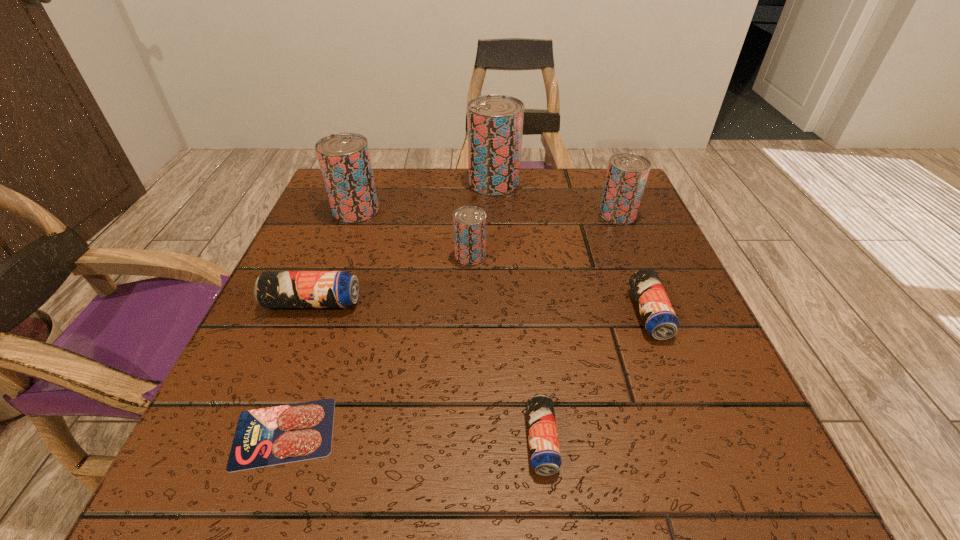
Find the location of a particular element. This screenshot has width=960, height=540. the farthest red beer can is located at coordinates (495, 122).

This screenshot has height=540, width=960. Find the location of `the tallest beer can`. the tallest beer can is located at coordinates (495, 122).

Where is `the second biggest red beer can`? the second biggest red beer can is located at coordinates (344, 158).

Identify the location of the seventh shortest object. Image resolution: width=960 pixels, height=540 pixels. (344, 158).

You are a GUI agent. You are given a task and a screenshot of the screen. Output one action in this format:
    pyautogui.click(x=<x>, y=<y>)
    Task: Click on the third biggest red beer can
    This screenshot has height=540, width=960.
    Given the screenshot: What is the action you would take?
    pyautogui.click(x=627, y=173)

You are a GUI agent. You are given a task and a screenshot of the screen. Output one action in this format:
    pyautogui.click(x=<x>, y=<y>)
    Task: Click on the third tallest object
    The height and width of the screenshot is (540, 960).
    Given the screenshot: What is the action you would take?
    pyautogui.click(x=627, y=173)

Find the location of a particular element. The image size is (960, 540). the fifth shortest object is located at coordinates (469, 222).

Identify the location of the fourth farthest beer can. This screenshot has height=540, width=960. [x=469, y=222].

Find the location of `the fourth shortest object`. the fourth shortest object is located at coordinates (273, 289).

Identify the location of the leftmost blue beer can. This screenshot has height=540, width=960. (273, 289).